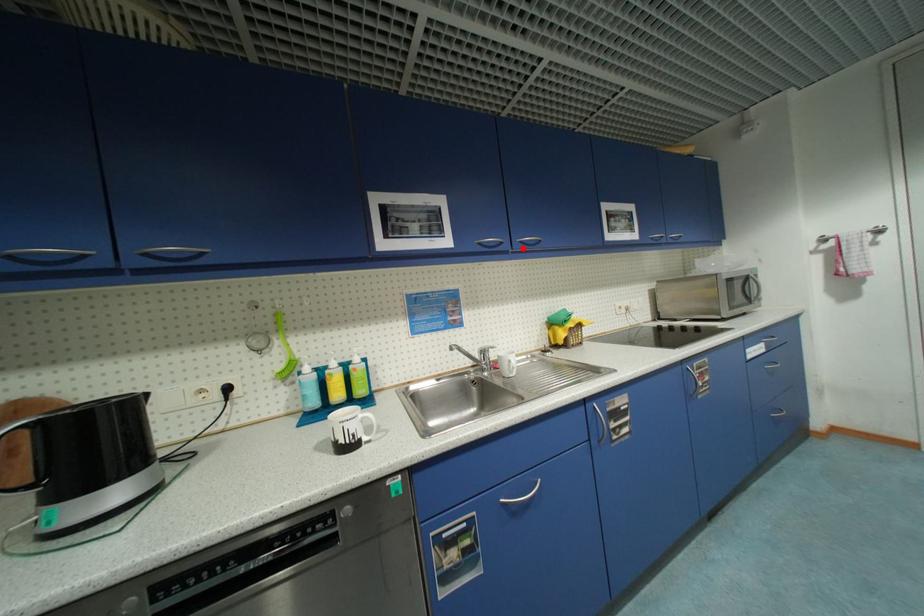
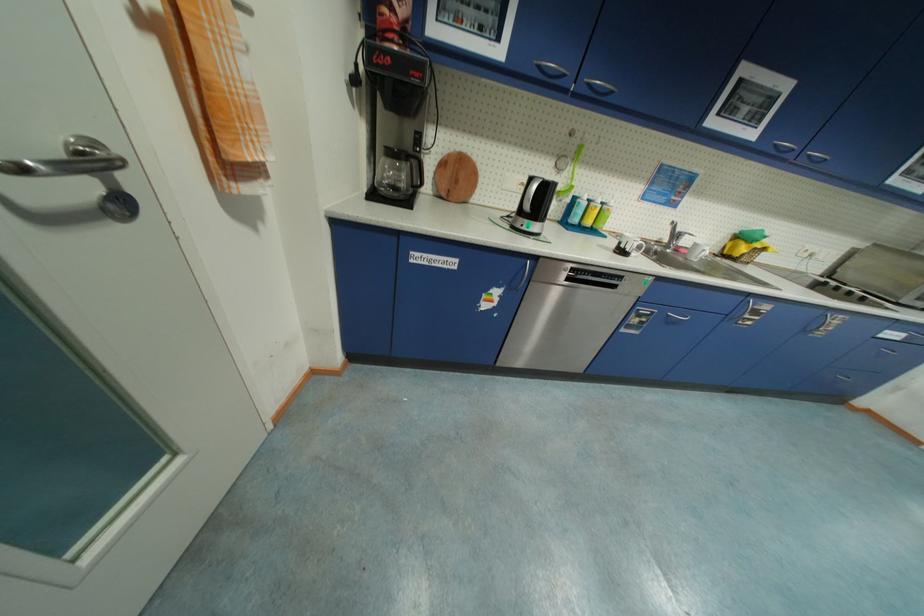
Where in the second image is the point corresponding to the highlighted location from the first image?

(807, 161)